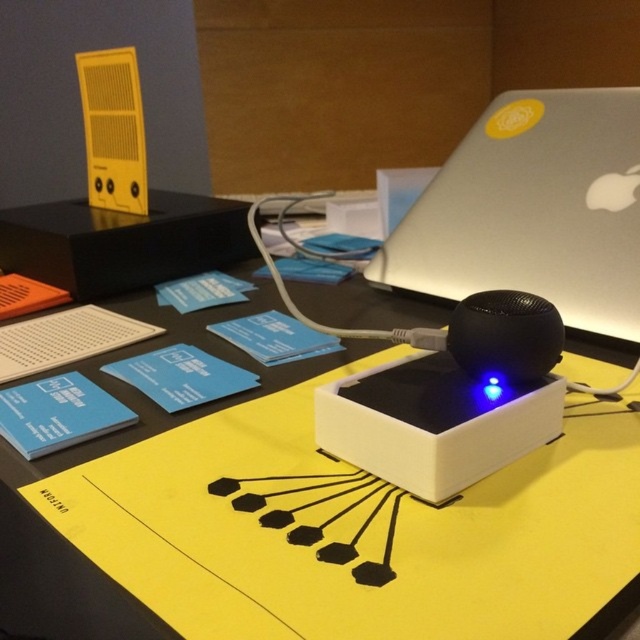
Does yellow matte table at center appear under silver metallic laptop at upper right?

Answer: Correct, yellow matte table at center is located below silver metallic laptop at upper right.

Who is taller, yellow matte table at center or silver metallic laptop at upper right?

With more height is silver metallic laptop at upper right.

This screenshot has width=640, height=640. I want to click on yellow matte table at center, so click(x=339, y=570).

Does yellow matte table at center appear over black matte box at upper left?

Actually, yellow matte table at center is below black matte box at upper left.

Between yellow matte table at center and black matte box at upper left, which one has more height?

black matte box at upper left is taller.

Is point (451, 593) positioned before point (64, 208)?

Yes, point (451, 593) is in front of point (64, 208).

This screenshot has height=640, width=640. I want to click on yellow matte table at center, so click(339, 570).

Between point (540, 170) and point (45, 241), which one is positioned in front?

Positioned in front is point (540, 170).

Between point (580, 269) and point (8, 243), which one is positioned behind?

The point (8, 243) is more distant.

Identify the location of silver metallic laptop at upper right. coord(532,211).